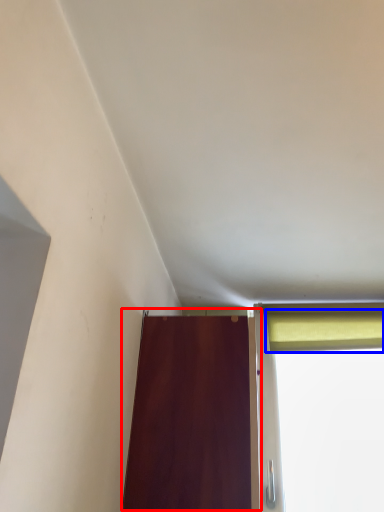
Question: Which object appears closest to the camera in this image, door (highlighted by a red box) or curtain (highlighted by a blue box)?

Choices:
 (A) door
 (B) curtain

Answer: (A)